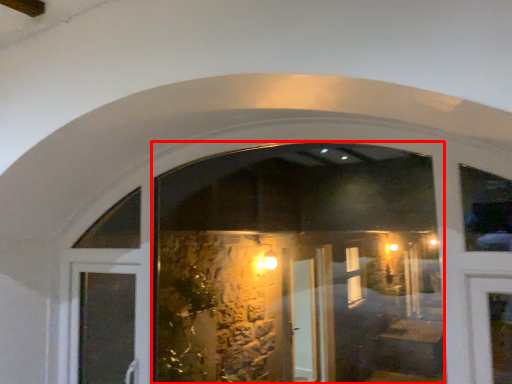
Question: From the image's perspective, considering the relative positions of shop window (annotated by the red box) and door in the image provided, where is shop window (annotated by the red box) located with respect to the staircase?

Choices:
 (A) below
 (B) above

Answer: (B)